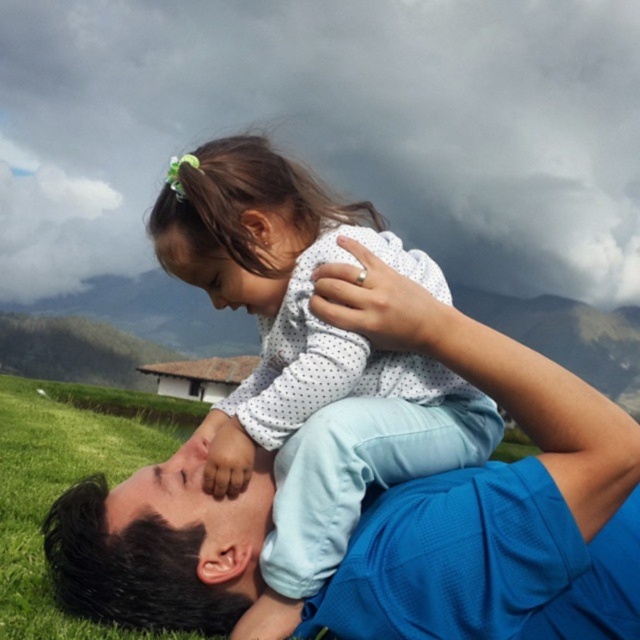
Is white dotted shirt at center thinner than green grass at lower left?

Yes, white dotted shirt at center is thinner than green grass at lower left.

Is point (417, 410) positioned in front of point (120, 628)?

No, (417, 410) is further to viewer.

Is point (417, 424) less distant than point (19, 552)?

That is True.

This screenshot has height=640, width=640. What are the coordinates of `white dotted shirt at center` in the screenshot? It's located at (307, 362).

Does blue fabric shirt at center come behind white dotted shirt at center?

That is False.

Measure the distance from blue fabric shirt at center to white dotted shirt at center.

blue fabric shirt at center and white dotted shirt at center are 14.27 inches apart.

What do you see at coordinates (492, 502) in the screenshot?
I see `blue fabric shirt at center` at bounding box center [492, 502].

Locate an element on the screen. This screenshot has width=640, height=640. blue fabric shirt at center is located at coordinates (492, 502).

Measure the distance between blue fabric shirt at center and camera.

A distance of 1.62 meters exists between blue fabric shirt at center and camera.

This screenshot has width=640, height=640. What do you see at coordinates (492, 502) in the screenshot? I see `blue fabric shirt at center` at bounding box center [492, 502].

Identify the location of blue fabric shirt at center. Image resolution: width=640 pixels, height=640 pixels. (492, 502).